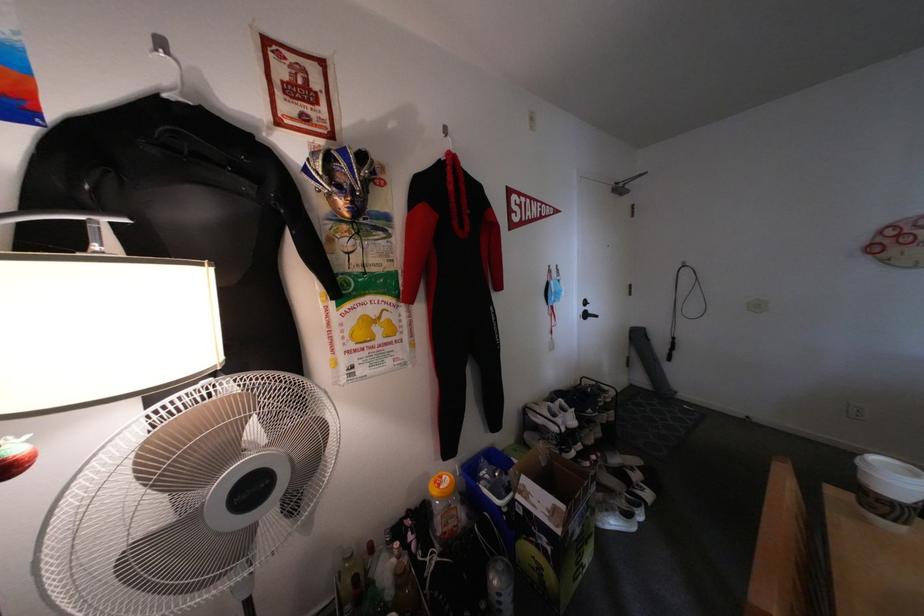
This screenshot has height=616, width=924. Identify the location of white wall hook. click(x=445, y=139).